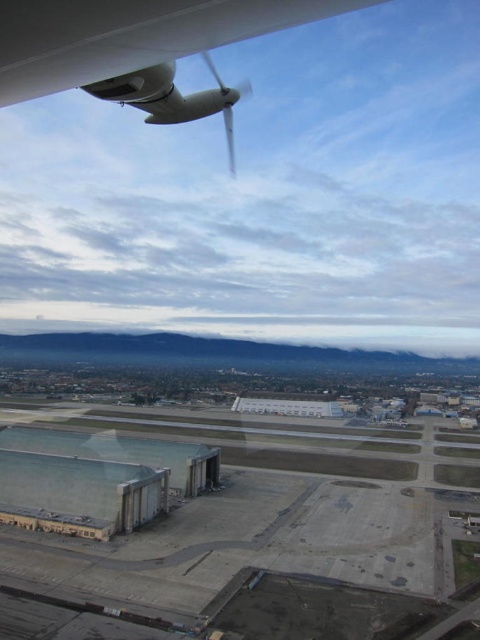
You are a pilot preparing for takeoff and need to check the visibility of the gray concrete tarmac at lower center and the white matte propeller at upper left. Which object takes up more area in your view?

The white matte propeller at upper left occupies more space in the view than the gray concrete tarmac at lower center according to the description.

You are a pilot preparing for takeoff and need to ensure there are no obstructions between the white matte propeller at upper left and the gray concrete tarmac at lower center. Given that the minimum safe distance for clearance is 700 feet, is the current distance sufficient?

The gray concrete tarmac at lower center and white matte propeller at upper left are 767.35 feet apart, which exceeds the minimum safe distance of 700 feet. Therefore, the clearance is sufficient for takeoff.

You are a pilot sitting in the cockpit of the aircraft and want to check the distance to the white matte propeller at upper left. Can you reach it by extending your arm fully? Assume your arm is 0.7 meters long.

The white matte propeller at upper left is 9.66 meters away from viewer. Since your arm is only 0.7 meters long, you cannot reach it by extending your arm fully.